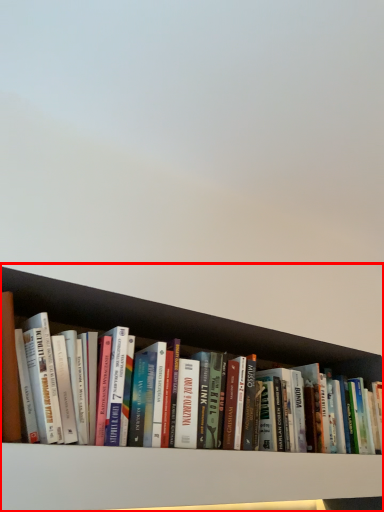
Question: Considering the relative positions of shelf (annotated by the red box) and shelf in the image provided, where is shelf (annotated by the red box) located with respect to the staircase?

Choices:
 (A) right
 (B) left

Answer: (A)